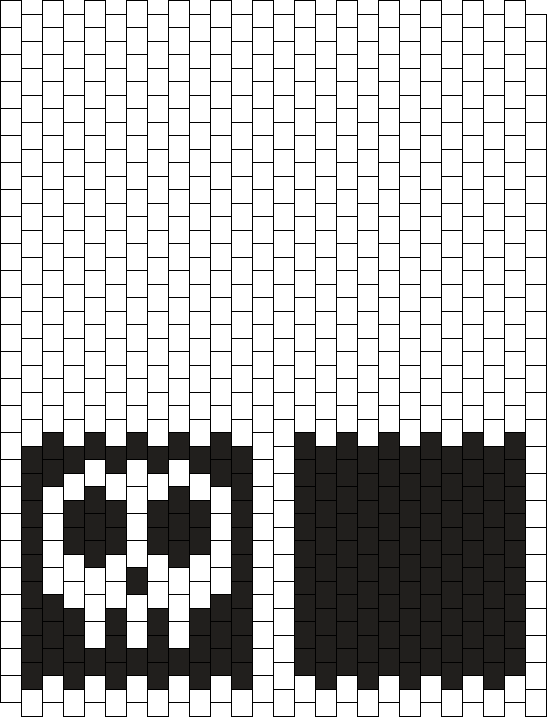
Locate an element on the screen. Image resolution: width=547 pixels, height=717 pixels. tile drawing is located at coordinates (286, 280).